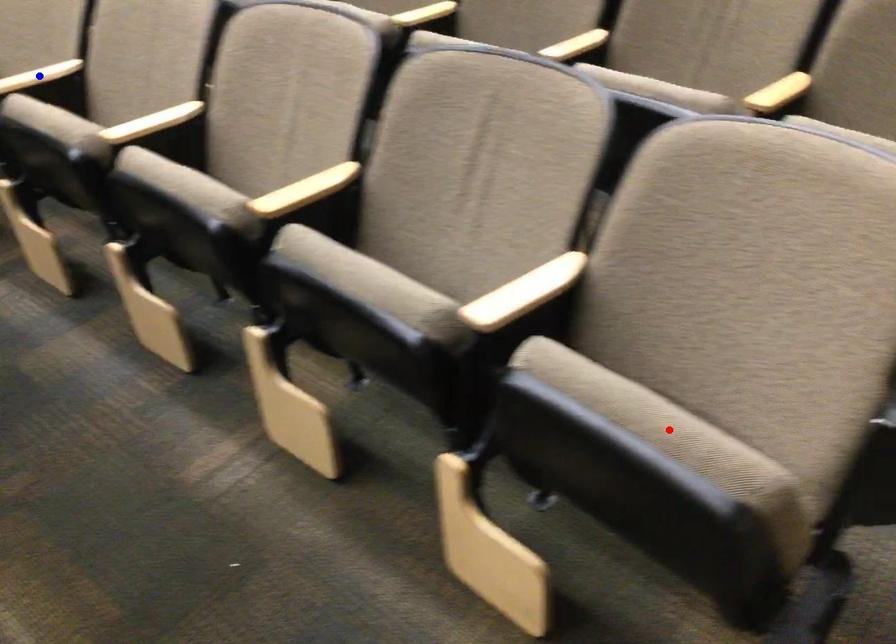
Question: In the image, two points are highlighted. Which point is nearer to the camera? Reply with the corresponding letter.

Choices:
 (A) blue point
 (B) red point

Answer: (B)